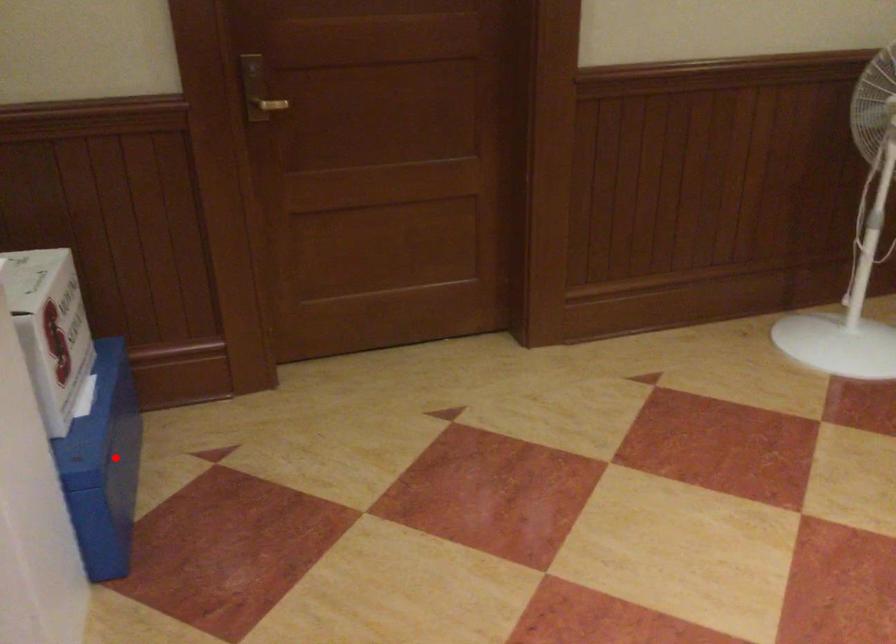
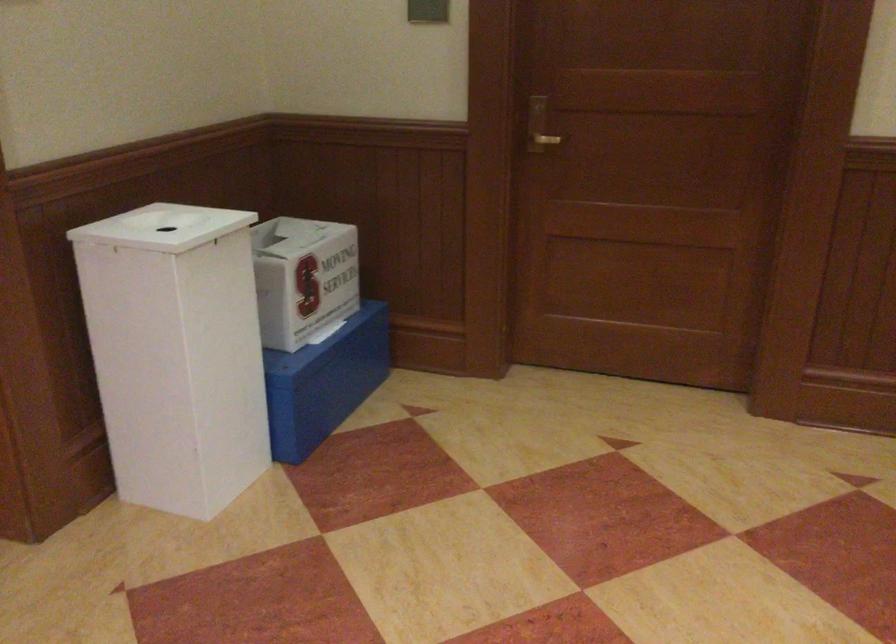
Question: I am providing you with two images of the same scene from different viewpoints. In image1, a red point is highlighted. Considering the same 3D point in image2, which of the following is correct?

Choices:
 (A) It is closer
 (B) It is farther

Answer: (B)